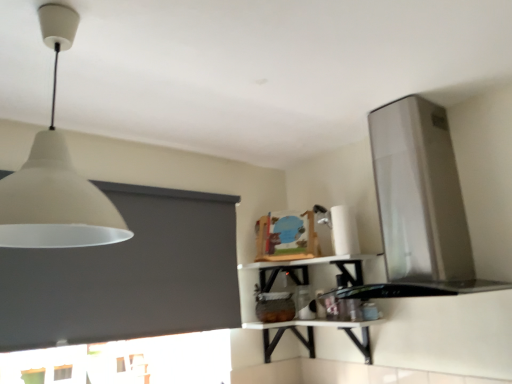
The height and width of the screenshot is (384, 512). What are the coordinates of `free spot above satin silver vent at upper right (from a real-world perspective)` in the screenshot? It's located at (394, 98).